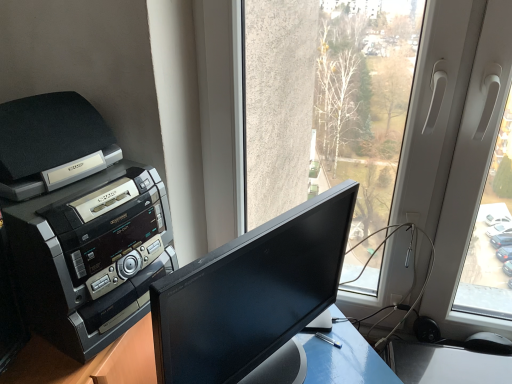
Image resolution: width=512 pixels, height=384 pixels. Describe the element at coordinates (79, 222) in the screenshot. I see `black plastic printer at left` at that location.

Where is `black glossy monitor at center`? This screenshot has width=512, height=384. black glossy monitor at center is located at coordinates (253, 298).

Considering the relative sizes of black glossy monitor at center and black plastic printer at left in the image provided, is black glossy monitor at center smaller than black plastic printer at left?

Yes.

In terms of height, does black glossy monitor at center look taller or shorter compared to black plastic printer at left?

Considering their sizes, black glossy monitor at center has less height than black plastic printer at left.

Is black glossy monitor at center positioned with its back to black plastic printer at left?

Yes.

In terms of width, does black glossy monitor at center look wider or thinner when compared to black plastic printer at left?

In the image, black glossy monitor at center appears to be more narrow than black plastic printer at left.

Is black plastic printer at left not inside black plastic mouse at lower right?

Absolutely, black plastic printer at left is external to black plastic mouse at lower right.

How much distance is there between black plastic printer at left and black plastic mouse at lower right?

black plastic printer at left and black plastic mouse at lower right are 37.38 inches apart from each other.

Considering the sizes of objects black plastic printer at left and black plastic mouse at lower right in the image provided, who is bigger, black plastic printer at left or black plastic mouse at lower right?

With larger size is black plastic printer at left.

Is point (482, 334) farther from camera compared to point (84, 236)?

Yes, it is.

From the image's perspective, is black plastic mouse at lower right above or below black plastic printer at left?

From the image's perspective, black plastic mouse at lower right appears below black plastic printer at left.

How different are the orientations of black plastic mouse at lower right and black plastic printer at left in degrees?

black plastic mouse at lower right and black plastic printer at left are facing 72.6 degrees away from each other.

Is black plastic printer at left inside the boundaries of black glossy monitor at center, or outside?

black plastic printer at left exists outside the volume of black glossy monitor at center.

From a real-world perspective, is black plastic printer at left over black glossy monitor at center?

Correct, in the physical world, black plastic printer at left is higher than black glossy monitor at center.

In the scene shown: How many degrees apart are the facing directions of black plastic printer at left and black glossy monitor at center?

There is a 15.1-degree angle between the facing directions of black plastic printer at left and black glossy monitor at center.

Which object is positioned more to the left, black plastic printer at left or black glossy monitor at center?

black plastic printer at left.

Which is less distant, (262,242) or (487,338)?

Point (262,242)

Is black glossy monitor at center at the left side of black plastic mouse at lower right?

Indeed, black glossy monitor at center is positioned on the left side of black plastic mouse at lower right.

From a real-world perspective, is black glossy monitor at center positioned above or below black plastic mouse at lower right?

black glossy monitor at center is above black plastic mouse at lower right.

Is black glossy monitor at center taller than black plastic mouse at lower right?

Yes.

Is black plastic mouse at lower right at the left side of black glossy monitor at center?

In fact, black plastic mouse at lower right is to the right of black glossy monitor at center.

Where is `computer monitor on the left of black plastic mouse at lower right`? computer monitor on the left of black plastic mouse at lower right is located at coordinates coord(253,298).

Is black plastic mouse at lower right taller than black glossy monitor at center?

Incorrect, the height of black plastic mouse at lower right is not larger of that of black glossy monitor at center.

Which is farther, (487, 337) or (282, 369)?

The point (487, 337) is farther from the camera.

Locate an element on the screen. The height and width of the screenshot is (384, 512). computer monitor that appears on the right of black plastic printer at left is located at coordinates (253, 298).

This screenshot has width=512, height=384. Identify the location of printer that is on the left side of black plastic mouse at lower right. (79, 222).

Based on the photo, looking at the image, which one is located closer to black plastic printer at left, black glossy monitor at center or black plastic mouse at lower right?

Based on the image, black glossy monitor at center appears to be nearer to black plastic printer at left.

When comparing their distances from black glossy monitor at center, does black plastic printer at left or black plastic mouse at lower right seem further?

Based on the image, black plastic mouse at lower right appears to be further to black glossy monitor at center.

When comparing their distances from black plastic mouse at lower right, does black plastic printer at left or black glossy monitor at center seem further?

The object further to black plastic mouse at lower right is black plastic printer at left.

Based on their spatial positions, is black glossy monitor at center or black plastic printer at left further from black plastic mouse at lower right?

black plastic printer at left is further to black plastic mouse at lower right.

Consider the image. From the image, which object appears to be nearer to black glossy monitor at center, black plastic mouse at lower right or black plastic printer at left?

black plastic printer at left.

Estimate the real-world distances between objects in this image. Which object is further from black plastic printer at left, black plastic mouse at lower right or black glossy monitor at center?

black plastic mouse at lower right is further to black plastic printer at left.

I want to click on computer monitor located between black plastic printer at left and black plastic mouse at lower right in the left-right direction, so (x=253, y=298).